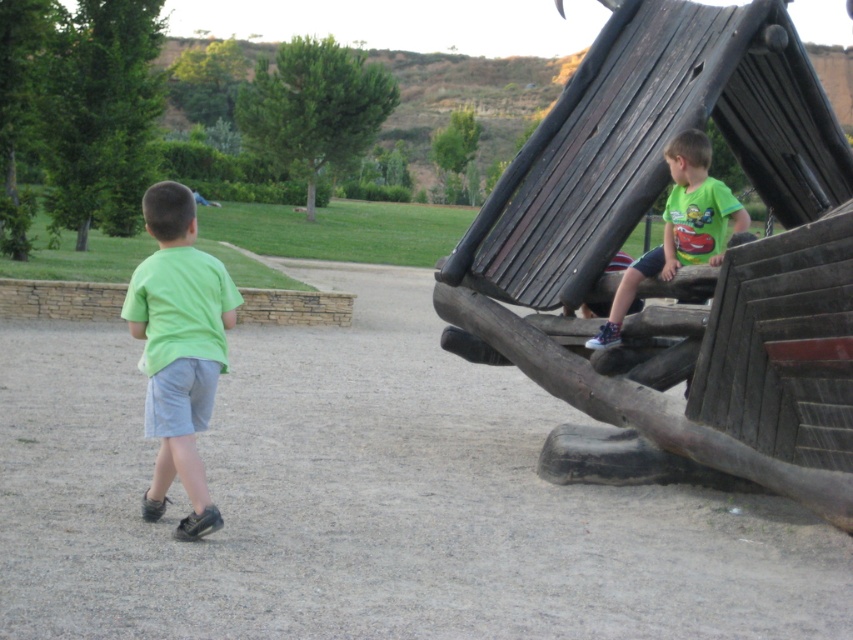
You are standing at the point closer to the camera between the two points, point (624,220) and point (228,308). Which point are you standing at?

You are standing at point (624,220) because it is further to the camera than point (228,308).